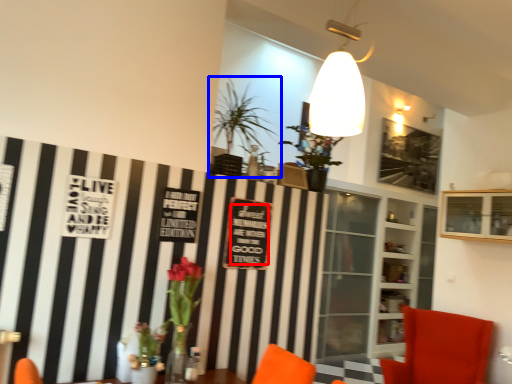
Question: Among these objects, which one is nearest to the camera, writing (highlighted by a red box) or houseplant (highlighted by a blue box)?

Choices:
 (A) writing
 (B) houseplant

Answer: (B)